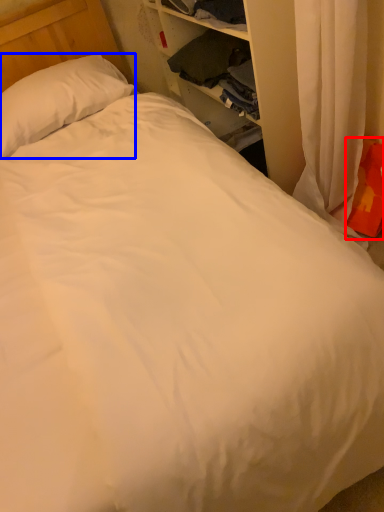
Question: Which point is further to the camera, pillow (highlighted by a red box) or pillow (highlighted by a blue box)?

Choices:
 (A) pillow
 (B) pillow

Answer: (B)